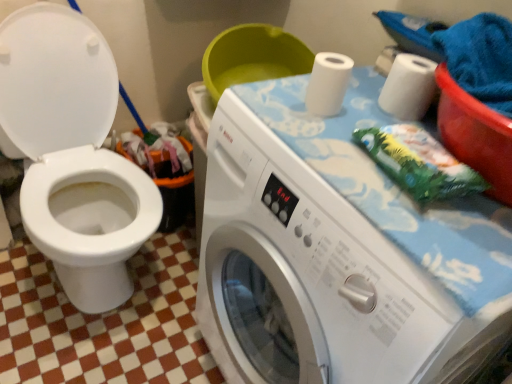
Image resolution: width=512 pixels, height=384 pixels. What do you see at coordinates (73, 153) in the screenshot? I see `white glossy toilet at left` at bounding box center [73, 153].

How much space does white matte toilet paper at upper right, marked as the 2th toilet paper in a left-to-right arrangement, occupy vertically?

white matte toilet paper at upper right, marked as the 2th toilet paper in a left-to-right arrangement, is 4.18 inches tall.

This screenshot has height=384, width=512. What do you see at coordinates (419, 163) in the screenshot?
I see `green fabric at upper right` at bounding box center [419, 163].

Where is `white glossy toilet at left`? white glossy toilet at left is located at coordinates (73, 153).

From the image's perspective, which object appears higher, orange plastic recycling bin at lower left or green fabric at upper right?

From the image's view, green fabric at upper right is above.

Find the location of a particular element. material in front of the orange plastic recycling bin at lower left is located at coordinates (419, 163).

Can you confirm if orange plastic recycling bin at lower left is shorter than green fabric at upper right?

No, orange plastic recycling bin at lower left is not shorter than green fabric at upper right.

Considering the positions of objects white plastic washing machine at center and white matte toilet paper at upper right, the 2th toilet paper in the right-to-left sequence, in the image provided, who is behind, white plastic washing machine at center or white matte toilet paper at upper right, the 2th toilet paper in the right-to-left sequence,?

white matte toilet paper at upper right, the 2th toilet paper in the right-to-left sequence, is more distant.

Is white plastic washing machine at center directly adjacent to white matte toilet paper at upper right, which is the 1th toilet paper in left-to-right order?

They are not placed beside each other.

Can you confirm if white plastic washing machine at center is bigger than white matte toilet paper at upper right, the 2th toilet paper in the right-to-left sequence?

Yes, white plastic washing machine at center is bigger than white matte toilet paper at upper right, the 2th toilet paper in the right-to-left sequence.

Is white plastic washing machine at center spatially inside white matte toilet paper at upper right, the 2th toilet paper in the right-to-left sequence, or outside of it?

The correct answer is: outside.

How far apart are white glossy toilet at left and orange plastic recycling bin at lower left?

white glossy toilet at left is 11.37 inches away from orange plastic recycling bin at lower left.

Is white glossy toilet at left far away from orange plastic recycling bin at lower left?

No, white glossy toilet at left is not far from orange plastic recycling bin at lower left.

Looking at this image, is white glossy toilet at left inside or outside of orange plastic recycling bin at lower left?

white glossy toilet at left is spatially situated outside orange plastic recycling bin at lower left.

From a real-world perspective, is white glossy toilet at left located higher than orange plastic recycling bin at lower left?

Yes, from a real-world perspective, white glossy toilet at left is on top of orange plastic recycling bin at lower left.

In the scene shown: How much distance is there between white matte toilet paper at upper right, marked as the 2th toilet paper in a left-to-right arrangement, and white matte toilet paper at upper right, the 2th toilet paper in the right-to-left sequence?

They are 13.26 centimeters apart.

From a real-world perspective, is white matte toilet paper at upper right, the first toilet paper from the right, located beneath white matte toilet paper at upper right, the 2th toilet paper in the right-to-left sequence?

Correct, in the physical world, white matte toilet paper at upper right, the first toilet paper from the right, is lower than white matte toilet paper at upper right, the 2th toilet paper in the right-to-left sequence.

Does white matte toilet paper at upper right, marked as the 2th toilet paper in a left-to-right arrangement, turn towards white matte toilet paper at upper right, the 2th toilet paper in the right-to-left sequence?

Yes, white matte toilet paper at upper right, marked as the 2th toilet paper in a left-to-right arrangement, faces towards white matte toilet paper at upper right, the 2th toilet paper in the right-to-left sequence.

Relative to white matte toilet paper at upper right, which is the 1th toilet paper in left-to-right order, is white matte toilet paper at upper right, marked as the 2th toilet paper in a left-to-right arrangement, in front or behind?

white matte toilet paper at upper right, marked as the 2th toilet paper in a left-to-right arrangement, is positioned farther from the viewer than white matte toilet paper at upper right, which is the 1th toilet paper in left-to-right order.

Which object is further away from the camera, white matte toilet paper at upper right, which is the 1th toilet paper in left-to-right order, or white plastic washing machine at center?

white matte toilet paper at upper right, which is the 1th toilet paper in left-to-right order, is more distant.

Identify the location of washing machine that is on the right side of white matte toilet paper at upper right, which is the 1th toilet paper in left-to-right order. The width and height of the screenshot is (512, 384). (339, 252).

Measure the distance from white matte toilet paper at upper right, the 2th toilet paper in the right-to-left sequence, to white plastic washing machine at center.

27.36 centimeters.

From the image's perspective, is white matte toilet paper at upper right, the 2th toilet paper in the right-to-left sequence, below white plastic washing machine at center?

Actually, white matte toilet paper at upper right, the 2th toilet paper in the right-to-left sequence, appears above white plastic washing machine at center in the image.

From the picture: From the image's perspective, is orange plastic recycling bin at lower left above or below white matte toilet paper at upper right, marked as the 2th toilet paper in a left-to-right arrangement?

Based on their image positions, orange plastic recycling bin at lower left is located beneath white matte toilet paper at upper right, marked as the 2th toilet paper in a left-to-right arrangement.

Can we say orange plastic recycling bin at lower left lies outside white matte toilet paper at upper right, marked as the 2th toilet paper in a left-to-right arrangement?

Absolutely, orange plastic recycling bin at lower left is external to white matte toilet paper at upper right, marked as the 2th toilet paper in a left-to-right arrangement.

Does orange plastic recycling bin at lower left have a greater height compared to white matte toilet paper at upper right, the first toilet paper from the right?

Correct, orange plastic recycling bin at lower left is much taller as white matte toilet paper at upper right, the first toilet paper from the right.

Is orange plastic recycling bin at lower left oriented towards white matte toilet paper at upper right, the 2th toilet paper in the right-to-left sequence?

No, orange plastic recycling bin at lower left does not turn towards white matte toilet paper at upper right, the 2th toilet paper in the right-to-left sequence.

Considering the positions of objects orange plastic recycling bin at lower left and white matte toilet paper at upper right, which is the 1th toilet paper in left-to-right order, in the image provided, who is more to the right, orange plastic recycling bin at lower left or white matte toilet paper at upper right, which is the 1th toilet paper in left-to-right order,?

From the viewer's perspective, white matte toilet paper at upper right, which is the 1th toilet paper in left-to-right order, appears more on the right side.

Is orange plastic recycling bin at lower left far from white matte toilet paper at upper right, the 2th toilet paper in the right-to-left sequence?

No, orange plastic recycling bin at lower left is not far from white matte toilet paper at upper right, the 2th toilet paper in the right-to-left sequence.

Considering the relative sizes of orange plastic recycling bin at lower left and white matte toilet paper at upper right, which is the 1th toilet paper in left-to-right order, in the image provided, is orange plastic recycling bin at lower left bigger than white matte toilet paper at upper right, which is the 1th toilet paper in left-to-right order,?

Yes.

Locate an element on the screen. The height and width of the screenshot is (384, 512). material in front of the orange plastic recycling bin at lower left is located at coordinates (419, 163).

Identify the location of the 1st toilet paper positioned above the white plastic washing machine at center (from the image's perspective). This screenshot has width=512, height=384. (328, 83).

Estimate the real-world distances between objects in this image. Which object is further from orange plastic recycling bin at lower left, green fabric at upper right or white plastic washing machine at center?

The object further to orange plastic recycling bin at lower left is green fabric at upper right.

Based on their spatial positions, is white matte toilet paper at upper right, the first toilet paper from the right, or white plastic washing machine at center further from white glossy toilet at left?

Answer: white matte toilet paper at upper right, the first toilet paper from the right.

When comparing their distances from white matte toilet paper at upper right, marked as the 2th toilet paper in a left-to-right arrangement, does white matte toilet paper at upper right, the 2th toilet paper in the right-to-left sequence, or orange plastic recycling bin at lower left seem closer?

white matte toilet paper at upper right, the 2th toilet paper in the right-to-left sequence.

Considering their positions, is white matte toilet paper at upper right, marked as the 2th toilet paper in a left-to-right arrangement, positioned closer to white glossy toilet at left than white matte toilet paper at upper right, the 2th toilet paper in the right-to-left sequence?

white matte toilet paper at upper right, the 2th toilet paper in the right-to-left sequence, is positioned closer to the anchor white glossy toilet at left.

From the image, which object appears to be nearer to white plastic washing machine at center, orange plastic recycling bin at lower left or green fabric at upper right?

green fabric at upper right is positioned closer to the anchor white plastic washing machine at center.

From the picture: Looking at the image, which one is located closer to white matte toilet paper at upper right, the 2th toilet paper in the right-to-left sequence, white matte toilet paper at upper right, marked as the 2th toilet paper in a left-to-right arrangement, or orange plastic recycling bin at lower left?

white matte toilet paper at upper right, marked as the 2th toilet paper in a left-to-right arrangement.

Consider the image. From the image, which object appears to be farther from white matte toilet paper at upper right, marked as the 2th toilet paper in a left-to-right arrangement, white glossy toilet at left or white plastic washing machine at center?

white glossy toilet at left is positioned further to the anchor white matte toilet paper at upper right, marked as the 2th toilet paper in a left-to-right arrangement.

When comparing their distances from green fabric at upper right, does white matte toilet paper at upper right, marked as the 2th toilet paper in a left-to-right arrangement, or white plastic washing machine at center seem closer?

Among the two, white plastic washing machine at center is located nearer to green fabric at upper right.

Identify the location of material between white glossy toilet at left and white matte toilet paper at upper right, the first toilet paper from the right, from left to right. The image size is (512, 384). (419, 163).

Where is `material between white matte toilet paper at upper right, which is the 1th toilet paper in left-to-right order, and white plastic washing machine at center vertically`? The height and width of the screenshot is (384, 512). material between white matte toilet paper at upper right, which is the 1th toilet paper in left-to-right order, and white plastic washing machine at center vertically is located at coordinates (419, 163).

The image size is (512, 384). Identify the location of recycling bin between white glossy toilet at left and white matte toilet paper at upper right, the first toilet paper from the right, from left to right. (164, 171).

Where is `toilet between green fabric at upper right and orange plastic recycling bin at lower left along the z-axis`? Image resolution: width=512 pixels, height=384 pixels. toilet between green fabric at upper right and orange plastic recycling bin at lower left along the z-axis is located at coordinates (73, 153).